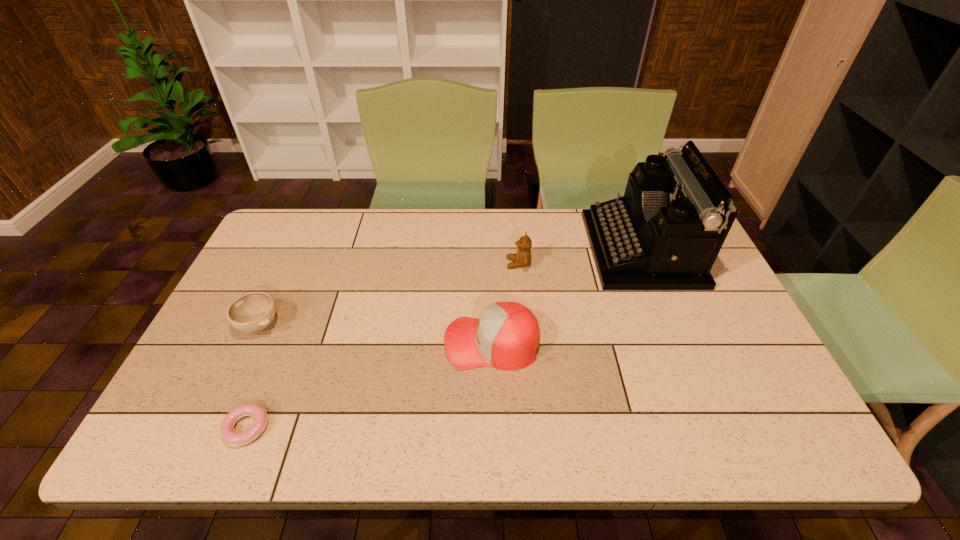
This screenshot has width=960, height=540. Find the location of `vacant space at the near right corner of the desktop`. vacant space at the near right corner of the desktop is located at coordinates (732, 433).

Identify the location of empty space between the baseball cap and the tallest object. (566, 296).

Locate an element on the screen. This screenshot has height=540, width=960. vacant area between the baseball cap and the typewriter is located at coordinates (566, 296).

The width and height of the screenshot is (960, 540). In order to click on vacant point located between the tallest object and the baseball cap in this screenshot , I will do `click(566, 296)`.

Where is `free point between the tallest object and the teddy bear`? This screenshot has width=960, height=540. free point between the tallest object and the teddy bear is located at coordinates (580, 256).

You are a GUI agent. You are given a task and a screenshot of the screen. Output one action in this format:
    pyautogui.click(x=<x>, y=<y>)
    Task: Click on the free space between the fourth tallest object and the teddy bear
    This screenshot has width=960, height=540.
    Given the screenshot: What is the action you would take?
    pyautogui.click(x=389, y=294)

Find the location of a particular element. The image size is (960, 540). vacant space that is in between the nearest object and the teddy bear is located at coordinates pyautogui.click(x=382, y=346).

This screenshot has width=960, height=540. In order to click on vacant space in between the teddy bear and the nearest object in this screenshot , I will do `click(382, 346)`.

The image size is (960, 540). In order to click on object that is the nearest to the doughnut in this screenshot , I will do pyautogui.click(x=252, y=312).

Identify which object is located as the fourth nearest to the teddy bear. Please provide its 2D coordinates. Your answer should be formatted as a tuple, i.e. [(x, y)], where the tuple contains the x and y coordinates of a point satisfying the conditions above.

[(228, 435)]